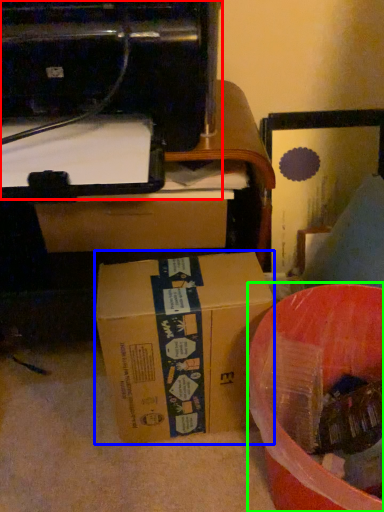
Question: Estimate the real-world distances between objects in this image. Which object is closer to printer (highlighted by a red box), box (highlighted by a blue box) or waste (highlighted by a green box)?

Choices:
 (A) box
 (B) waste

Answer: (A)